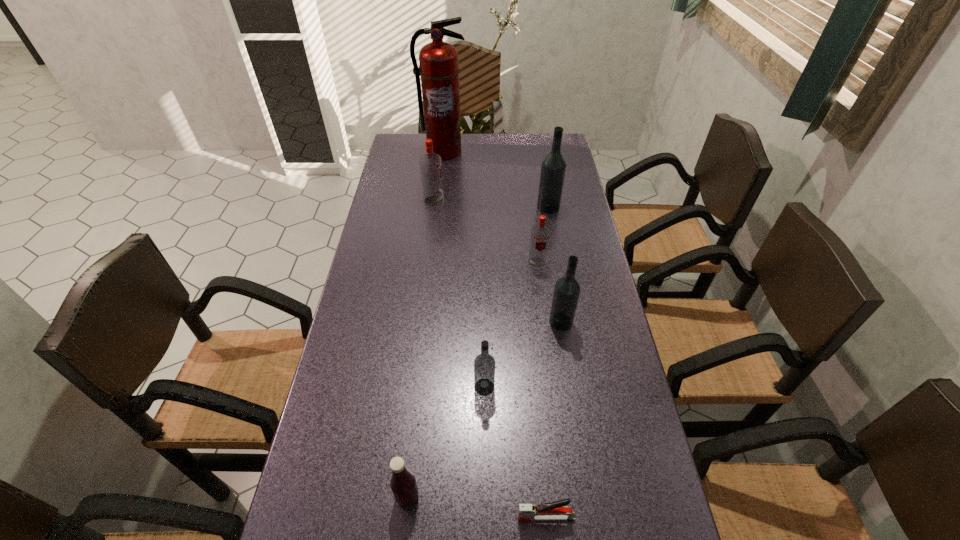
In the image, there is a desktop. What are the coordinates of `blank space at the far edge` in the screenshot? It's located at (479, 147).

Image resolution: width=960 pixels, height=540 pixels. In order to click on blank space at the left edge of the desktop in this screenshot , I will do `click(362, 307)`.

The image size is (960, 540). I want to click on vacant space at the right edge of the desktop, so click(604, 311).

This screenshot has width=960, height=540. In the image, there is a desktop. Find the location of `vacant space at the far left corner`. vacant space at the far left corner is located at coordinates (423, 138).

The height and width of the screenshot is (540, 960). What are the coordinates of `free spot between the farther red vodka and the third nearest vodka` in the screenshot? It's located at (486, 232).

Image resolution: width=960 pixels, height=540 pixels. I want to click on free space between the tallest object and the leftmost black vodka, so click(x=464, y=269).

At what (x,y) coordinates should I click in order to perform the action: click on free spot between the seventh shortest object and the second nearest vodka. Please return your answer as a coordinate pair (x, y). The height and width of the screenshot is (540, 960). Looking at the image, I should click on (555, 265).

The width and height of the screenshot is (960, 540). I want to click on free area in between the second nearest black vodka and the leftmost vodka, so point(497,261).

This screenshot has width=960, height=540. I want to click on empty space between the fire extinguisher and the leftmost black vodka, so coord(464,269).

At what (x,y) coordinates should I click in order to perform the action: click on vacant region between the second nearest vodka and the fifth nearest object. Please return your answer as a coordinate pair (x, y). The image size is (960, 540). Looking at the image, I should click on (549, 292).